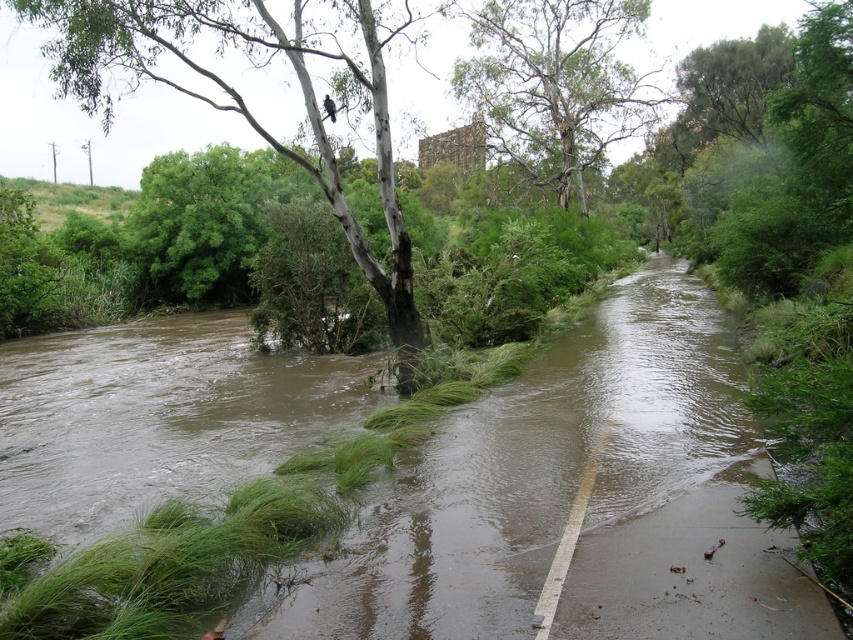
You are standing at point (258, 58) in the flooded area. You need to cross the flooded road to reach the tree on the left. Can you safely walk across the road if the water is 1.5 meters deep?

The water depth is not provided in the scene description, so it is impossible to determine if it is safe to cross. However, the distance between you and the tree is 74.46 meters, which is quite far. Proceed with caution and assess the water conditions first.

You are a hiker trying to navigate through the flooded area. You see the green leafy tree at left and the green rough bark tree at upper center. Which tree would appear larger in your view?

The green leafy tree at left appears larger because it is closer to the viewer than the green rough bark tree at upper center.